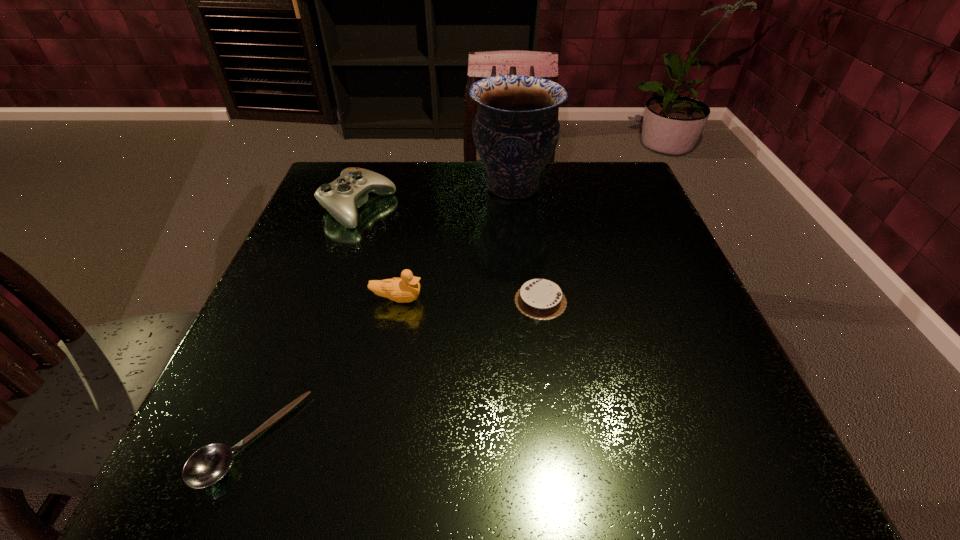
You are a GUI agent. You are given a task and a screenshot of the screen. Output one action in this format:
    pyautogui.click(x=<x>, y=<y>)
    Task: Click on the free space at the far edge of the desktop
    The height and width of the screenshot is (540, 960).
    Given the screenshot: What is the action you would take?
    tap(441, 170)

In the image, there is a desktop. What are the coordinates of `free space at the near edge` in the screenshot? It's located at (455, 434).

In the image, there is a desktop. At what (x,y) coordinates should I click in order to perform the action: click on vacant area at the left edge. Please return your answer as a coordinate pair (x, y). Looking at the image, I should click on (313, 308).

This screenshot has width=960, height=540. Identify the location of vacant space at the right edge of the desktop. (641, 278).

Locate an element on the screen. Image resolution: width=960 pixels, height=540 pixels. vacant space at the far left corner of the desktop is located at coordinates (349, 164).

You are a GUI agent. You are given a task and a screenshot of the screen. Output one action in this format:
    pyautogui.click(x=<x>, y=<y>)
    Task: Click on the vacant position at the far right corner of the desktop
    This screenshot has height=540, width=960.
    Given the screenshot: What is the action you would take?
    pyautogui.click(x=593, y=185)

Where is `free area in between the chocolate cake and the tallest object`? The width and height of the screenshot is (960, 540). free area in between the chocolate cake and the tallest object is located at coordinates (x=527, y=244).

Find the location of a particular element. The image size is (960, 540). empty space that is in between the duckling and the second shortest object is located at coordinates (469, 300).

The height and width of the screenshot is (540, 960). I want to click on free area in between the third object from right to left and the tallest object, so point(455,243).

At what (x,y) coordinates should I click in order to perform the action: click on unoccupied position between the second shortest object and the pottery. Please return your answer as a coordinate pair (x, y). This screenshot has height=540, width=960. Looking at the image, I should click on (527, 244).